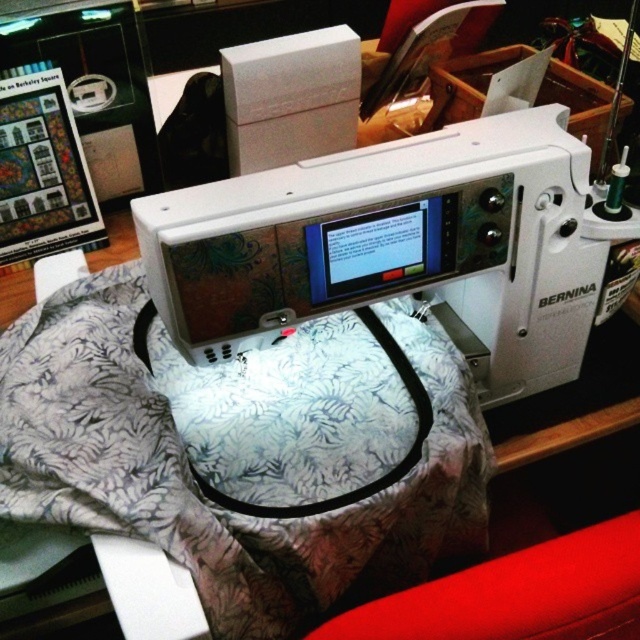
Question: Which object appears farthest from the camera in this image?

Choices:
 (A) white floral fabric at center
 (B) white plastic sewing machine at center
 (C) red fabric at lower right

Answer: (A)

Question: Does white floral fabric at center come in front of red fabric at lower right?

Choices:
 (A) no
 (B) yes

Answer: (A)

Question: Is white plastic sewing machine at center thinner than red fabric at lower right?

Choices:
 (A) yes
 (B) no

Answer: (B)

Question: Can you confirm if white floral fabric at center is positioned to the left of white plastic sewing machine at center?

Choices:
 (A) yes
 (B) no

Answer: (A)

Question: Which point appears closest to the camera in this image?

Choices:
 (A) (150, 531)
 (B) (502, 618)
 (C) (452, 168)

Answer: (B)

Question: Which object is closer to the camera taking this photo?

Choices:
 (A) white plastic sewing machine at center
 (B) red fabric at lower right
 (C) white floral fabric at center

Answer: (B)